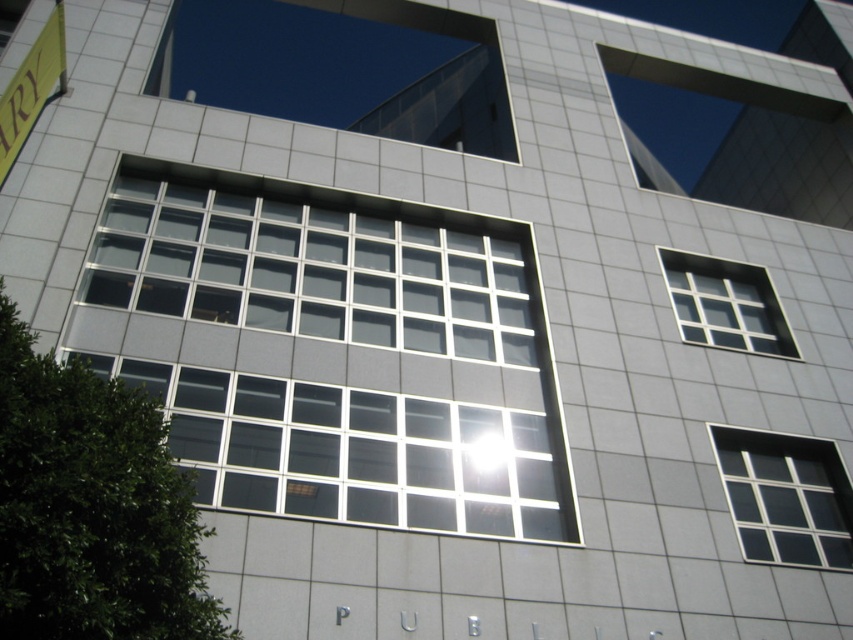
You are an architect designing a new building inspired by this facade. You want to ensure that the central window is visually dominant. Based on the image, which window is wider, the clear glass window at center or the clear glass window at upper right?

The clear glass window at center is wider than the clear glass window at upper right according to the description.

You are a window cleaner standing at the base of the building. You need to clean two windows, the clear glass window at center right and the clear glass window at upper right. The safety harness you have can reach up to 20 feet. Can you safely clean both windows without needing to move your harness?

The clear glass window at center right is 20.59 feet away from the clear glass window at upper right. Since the distance between them is 20.59 feet, which exceeds the 20 feet reach of your safety harness, you cannot safely clean both windows without moving your harness.

You are an architect reviewing the building facade. You notice a point at coordinates point (338, 349). Which object does this point correspond to?

The point (338, 349) corresponds to the clear glass window at center.